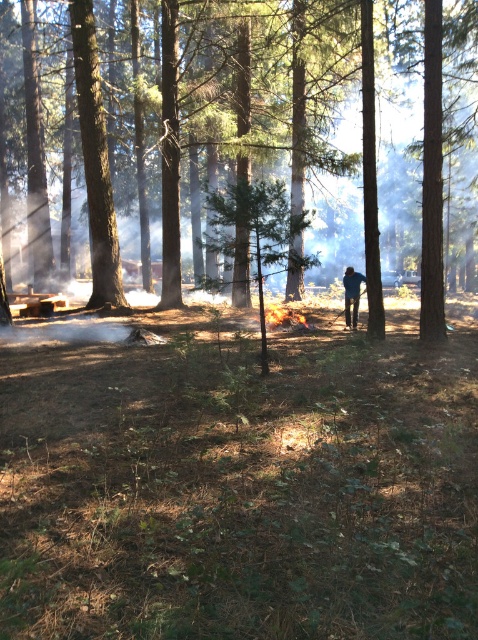
You are a firefighter observing the controlled burn in the forest. You notice a green textured tree at center and a blue denim jeans at center. Which object is taller?

The green textured tree at center is taller than the blue denim jeans at center.

Looking at this image, you are a firefighter observing the controlled burn in the forest. You notice a green textured tree at center and blue denim jeans at center. Which object is located higher in the scene?

The green textured tree at center is positioned over blue denim jeans at center, so the tree is higher up in the scene.

You are standing in the forest and see the green textured tree at center and the blue denim jeans at center. Which object is positioned to the left of the other?

The green textured tree at center is to the left of blue denim jeans at center according to the description.